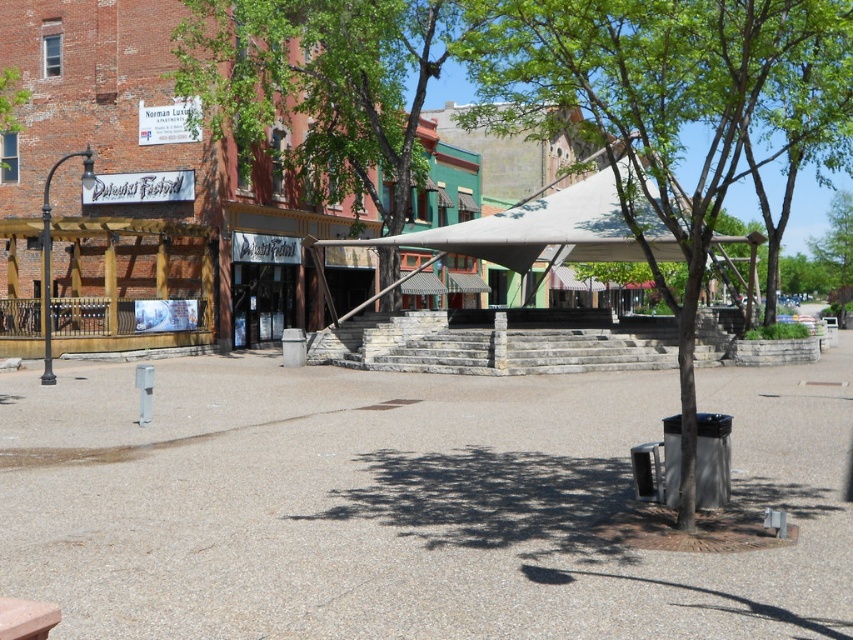
Which of these two, green leafy tree at center or green leafy tree at upper center, stands shorter?

green leafy tree at upper center is shorter.

Measure the distance from green leafy tree at center to green leafy tree at upper center.

A distance of 11.76 meters exists between green leafy tree at center and green leafy tree at upper center.

The image size is (853, 640). I want to click on green leafy tree at center, so click(666, 108).

This screenshot has height=640, width=853. I want to click on green leafy tree at center, so click(666, 108).

Is point (601, 22) less distant than point (532, 237)?

Yes, it is in front of point (532, 237).

Is green leafy tree at center behind white fabric canopy at center?

Yes.

Is point (706, 193) closer to camera compared to point (672, 200)?

Yes.

The height and width of the screenshot is (640, 853). Identify the location of green leafy tree at center. (666, 108).

How distant is green leafy tree at upper center from white fabric canopy at center?

A distance of 19.29 feet exists between green leafy tree at upper center and white fabric canopy at center.

Does point (358, 52) come closer to viewer compared to point (589, 257)?

Yes.

You are a GUI agent. You are given a task and a screenshot of the screen. Output one action in this format:
    pyautogui.click(x=<x>, y=<y>)
    Task: Click on the green leafy tree at upper center
    
    Given the screenshot: What is the action you would take?
    pyautogui.click(x=323, y=84)